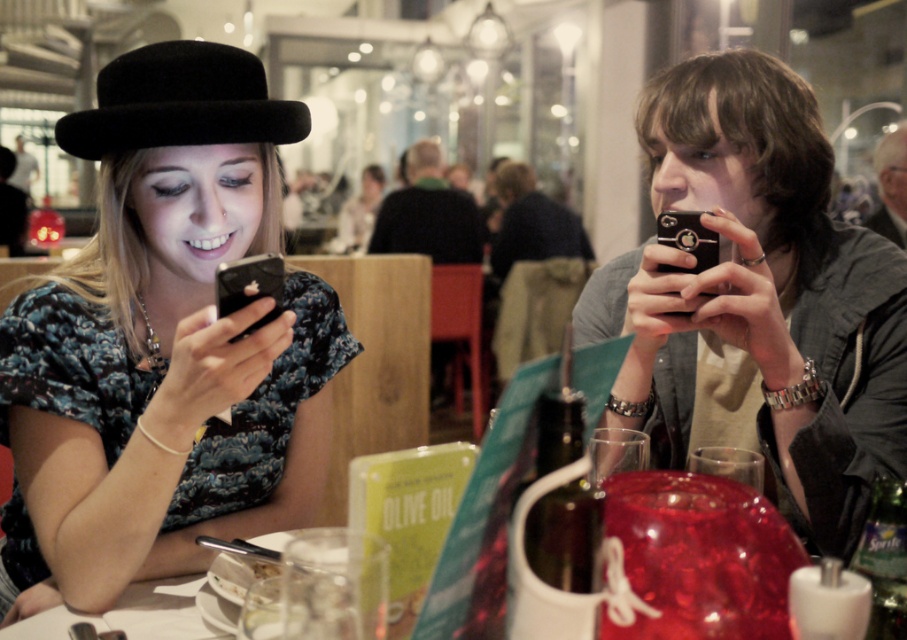
Question: Which point is closer to the camera?

Choices:
 (A) matte black hat at upper left
 (B) black matte phone at right
 (C) black felt fedora at upper left

Answer: (A)

Question: Can you confirm if black matte phone at right is wider than black felt fedora at upper left?

Choices:
 (A) yes
 (B) no

Answer: (A)

Question: Can you confirm if matte black hat at upper left is positioned to the right of black felt fedora at upper left?

Choices:
 (A) yes
 (B) no

Answer: (A)

Question: Does black felt fedora at upper left have a smaller size compared to black matte smartphone at left?

Choices:
 (A) no
 (B) yes

Answer: (A)

Question: Which object appears closest to the camera in this image?

Choices:
 (A) black matte phone at right
 (B) black matte smartphone at left
 (C) matte black hat at upper left

Answer: (B)

Question: Which of the following is the closest to the observer?

Choices:
 (A) (188, 516)
 (B) (233, 269)
 (C) (735, 51)
 (D) (103, 80)

Answer: (B)